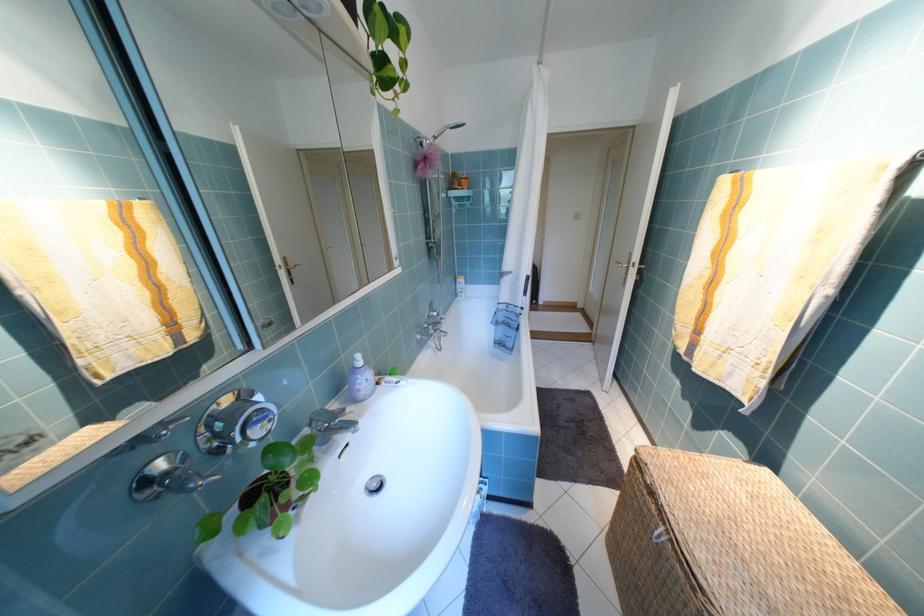
Where would you pull the gold door handle? Please return your answer as a coordinate pair (x, y).

(625, 262)